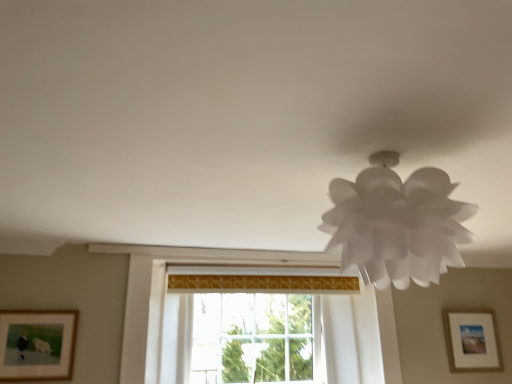
This screenshot has width=512, height=384. Find the location of `white paper lamp at upper right`. white paper lamp at upper right is located at coordinates (397, 223).

From the image's perspective, which is above, wooden framed picture at lower left, which ranks as the 2th picture frame in right-to-left order, or transparent glass window at center?

wooden framed picture at lower left, which ranks as the 2th picture frame in right-to-left order, appears higher in the image.

From a real-world perspective, is wooden framed picture at lower left, which appears as the first picture frame when viewed from the left, physically below transparent glass window at center?

Yes, from a real-world perspective, wooden framed picture at lower left, which appears as the first picture frame when viewed from the left, is below transparent glass window at center.

Which is correct: wooden framed picture at lower left, which ranks as the 2th picture frame in right-to-left order, is inside transparent glass window at center, or outside of it?

wooden framed picture at lower left, which ranks as the 2th picture frame in right-to-left order, is outside transparent glass window at center.

Between wooden framed picture at lower left, which ranks as the 2th picture frame in right-to-left order, and transparent glass window at center, which one has larger size?

With larger size is transparent glass window at center.

Does white paper lamp at upper right turn towards transparent glass window at center?

No, white paper lamp at upper right is not turned towards transparent glass window at center.

Considering the relative positions of white paper lamp at upper right and transparent glass window at center in the image provided, is white paper lamp at upper right to the left of transparent glass window at center from the viewer's perspective?

Incorrect, white paper lamp at upper right is not on the left side of transparent glass window at center.

In the scene shown: Which of these two, white paper lamp at upper right or transparent glass window at center, stands shorter?

Standing shorter between the two is white paper lamp at upper right.

From a real-world perspective, is white paper lamp at upper right physically below transparent glass window at center?

No, from a real-world perspective, white paper lamp at upper right is not under transparent glass window at center.

Between wooden framed picture at lower left, which appears as the first picture frame when viewed from the left, and white paper lamp at upper right, which one has larger width?

Wider between the two is white paper lamp at upper right.

Is wooden framed picture at lower left, which ranks as the 2th picture frame in right-to-left order, looking in the opposite direction of white paper lamp at upper right?

No, wooden framed picture at lower left, which ranks as the 2th picture frame in right-to-left order,'s orientation is not away from white paper lamp at upper right.

From the image's perspective, which one is positioned higher, wooden framed picture at lower left, marked as the 2th picture frame in a back-to-front arrangement, or white paper lamp at upper right?

white paper lamp at upper right is shown above in the image.

Does wooden framed picture at lower left, which ranks as the 2th picture frame in right-to-left order, have a larger size compared to white paper lamp at upper right?

Incorrect, wooden framed picture at lower left, which ranks as the 2th picture frame in right-to-left order, is not larger than white paper lamp at upper right.

From a real-world perspective, is transparent glass window at center positioned above or below white paper lamp at upper right?

transparent glass window at center is situated lower than white paper lamp at upper right in the real world.

Where is `lamp above the transparent glass window at center (from a real-world perspective)`? This screenshot has width=512, height=384. lamp above the transparent glass window at center (from a real-world perspective) is located at coordinates (397, 223).

In terms of width, does transparent glass window at center look wider or thinner when compared to white paper lamp at upper right?

Clearly, transparent glass window at center has less width compared to white paper lamp at upper right.

Which is nearer, (282, 304) or (400, 250)?

The point (400, 250) is in front.

Which object is more forward, matte white picture frame at lower right, which ranks as the first picture frame in right-to-left order, or transparent glass window at center?

Positioned in front is transparent glass window at center.

Who is smaller, matte white picture frame at lower right, positioned as the first picture frame in back-to-front order, or transparent glass window at center?

matte white picture frame at lower right, positioned as the first picture frame in back-to-front order, is smaller.

From the picture: From a real-world perspective, is matte white picture frame at lower right, the second picture frame positioned from the front, positioned over transparent glass window at center based on gravity?

No.

Is wooden framed picture at lower left, which ranks as the 2th picture frame in right-to-left order, not near matte white picture frame at lower right, positioned as the first picture frame in back-to-front order?

Yes, wooden framed picture at lower left, which ranks as the 2th picture frame in right-to-left order, is far from matte white picture frame at lower right, positioned as the first picture frame in back-to-front order.

Is wooden framed picture at lower left, marked as the 2th picture frame in a back-to-front arrangement, behind matte white picture frame at lower right, which ranks as the first picture frame in right-to-left order?

No, it is in front of matte white picture frame at lower right, which ranks as the first picture frame in right-to-left order.

From the image's perspective, is wooden framed picture at lower left, which appears as the first picture frame when viewed from the left, located above or below matte white picture frame at lower right, the second picture frame positioned from the front?

From the image's perspective, wooden framed picture at lower left, which appears as the first picture frame when viewed from the left, appears above matte white picture frame at lower right, the second picture frame positioned from the front.

Would you say wooden framed picture at lower left, the first picture frame positioned from the front, is to the left or to the right of matte white picture frame at lower right, the second picture frame when ordered from left to right, in the picture?

Clearly, wooden framed picture at lower left, the first picture frame positioned from the front, is on the left of matte white picture frame at lower right, the second picture frame when ordered from left to right, in the image.

Considering the sizes of objects white paper lamp at upper right and wooden framed picture at lower left, which ranks as the 2th picture frame in right-to-left order, in the image provided, who is bigger, white paper lamp at upper right or wooden framed picture at lower left, which ranks as the 2th picture frame in right-to-left order,?

white paper lamp at upper right.

Is wooden framed picture at lower left, which appears as the first picture frame when viewed from the left, a part of white paper lamp at upper right?

Definitely not — wooden framed picture at lower left, which appears as the first picture frame when viewed from the left, is not inside white paper lamp at upper right.

Considering the sizes of white paper lamp at upper right and wooden framed picture at lower left, which appears as the first picture frame when viewed from the left, in the image, is white paper lamp at upper right taller or shorter than wooden framed picture at lower left, which appears as the first picture frame when viewed from the left,?

Clearly, white paper lamp at upper right is taller compared to wooden framed picture at lower left, which appears as the first picture frame when viewed from the left.

At what (x,y) coordinates should I click in order to perform the action: click on window below the wooden framed picture at lower left, which appears as the first picture frame when viewed from the left (from the image's perspective). Please return your answer as a coordinate pair (x, y). Looking at the image, I should click on (253, 338).

Identify the location of lamp above the transparent glass window at center (from the image's perspective). Image resolution: width=512 pixels, height=384 pixels. (397, 223).

Considering their positions, is matte white picture frame at lower right, positioned as the first picture frame in back-to-front order, positioned closer to white paper lamp at upper right than wooden framed picture at lower left, which ranks as the 2th picture frame in right-to-left order?

The object closer to white paper lamp at upper right is wooden framed picture at lower left, which ranks as the 2th picture frame in right-to-left order.

Based on their spatial positions, is wooden framed picture at lower left, the first picture frame positioned from the front, or transparent glass window at center closer to matte white picture frame at lower right, the second picture frame when ordered from left to right?

transparent glass window at center is positioned closer to the anchor matte white picture frame at lower right, the second picture frame when ordered from left to right.

Looking at the image, which one is located closer to transparent glass window at center, white paper lamp at upper right or matte white picture frame at lower right, which ranks as the first picture frame in right-to-left order?

matte white picture frame at lower right, which ranks as the first picture frame in right-to-left order, lies closer to transparent glass window at center than the other object.

From the image, which object appears to be farther from wooden framed picture at lower left, which ranks as the 2th picture frame in right-to-left order, transparent glass window at center or white paper lamp at upper right?

white paper lamp at upper right is further to wooden framed picture at lower left, which ranks as the 2th picture frame in right-to-left order.

Considering their positions, is transparent glass window at center positioned closer to white paper lamp at upper right than matte white picture frame at lower right, the second picture frame positioned from the front?

transparent glass window at center is positioned closer to the anchor white paper lamp at upper right.

Estimate the real-world distances between objects in this image. Which object is further from transparent glass window at center, wooden framed picture at lower left, which ranks as the 2th picture frame in right-to-left order, or matte white picture frame at lower right, the second picture frame positioned from the front?

matte white picture frame at lower right, the second picture frame positioned from the front, lies further to transparent glass window at center than the other object.

Based on their spatial positions, is transparent glass window at center or matte white picture frame at lower right, the second picture frame positioned from the front, further from wooden framed picture at lower left, marked as the 2th picture frame in a back-to-front arrangement?

Answer: The object further to wooden framed picture at lower left, marked as the 2th picture frame in a back-to-front arrangement, is matte white picture frame at lower right, the second picture frame positioned from the front.

Estimate the real-world distances between objects in this image. Which object is further from matte white picture frame at lower right, the second picture frame positioned from the front, wooden framed picture at lower left, which appears as the first picture frame when viewed from the left, or white paper lamp at upper right?

wooden framed picture at lower left, which appears as the first picture frame when viewed from the left, is positioned further to the anchor matte white picture frame at lower right, the second picture frame positioned from the front.

Find the location of a particular element. The height and width of the screenshot is (384, 512). window positioned between white paper lamp at upper right and matte white picture frame at lower right, the second picture frame when ordered from left to right, from near to far is located at coordinates (253, 338).

Where is `picture frame located between white paper lamp at upper right and transparent glass window at center in the depth direction`? Image resolution: width=512 pixels, height=384 pixels. picture frame located between white paper lamp at upper right and transparent glass window at center in the depth direction is located at coordinates (37, 344).

I want to click on window between wooden framed picture at lower left, the first picture frame positioned from the front, and matte white picture frame at lower right, the second picture frame when ordered from left to right, from left to right, so click(253, 338).

You are a GUI agent. You are given a task and a screenshot of the screen. Output one action in this format:
    pyautogui.click(x=<x>, y=<y>)
    Task: Click on the lamp between wooden framed picture at lower left, which ranks as the 2th picture frame in right-to-left order, and matte white picture frame at lower right, positioned as the first picture frame in back-to-front order, from left to right
    The height and width of the screenshot is (384, 512).
    Given the screenshot: What is the action you would take?
    pyautogui.click(x=397, y=223)